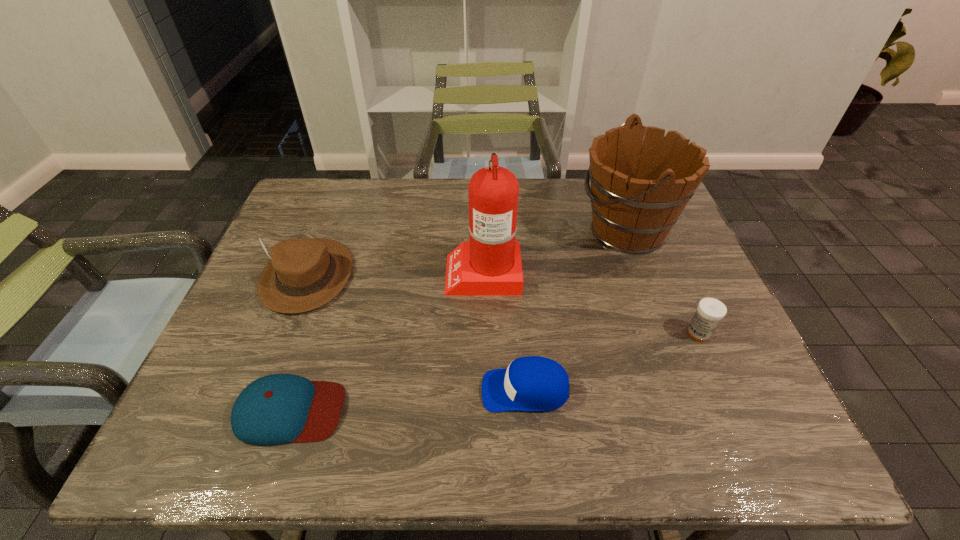
Where is `free space between the tallest object and the shortest object`? The height and width of the screenshot is (540, 960). free space between the tallest object and the shortest object is located at coordinates (387, 341).

Image resolution: width=960 pixels, height=540 pixels. Identify the location of free space between the right baseball cap and the shorter baseball cap. (408, 400).

Where is `vacant space that's between the third nearest object and the right baseball cap`? vacant space that's between the third nearest object and the right baseball cap is located at coordinates (612, 362).

Locate an element on the screen. object that is the fourth closest to the fourth farthest object is located at coordinates (279, 408).

Image resolution: width=960 pixels, height=540 pixels. Identify the location of the fifth closest object to the right baseball cap. (303, 274).

Where is `vacant region that satisfies the following two spatial constraints: 1. on the front side of the fourth tallest object; 2. with the bill of the shorter baseball cap facing forward`? vacant region that satisfies the following two spatial constraints: 1. on the front side of the fourth tallest object; 2. with the bill of the shorter baseball cap facing forward is located at coordinates (732, 410).

In order to click on blank area in the image that satisfies the following two spatial constraints: 1. on the front-facing side of the fire extinguisher; 2. on the right side of the medicine in this screenshot , I will do [x=484, y=333].